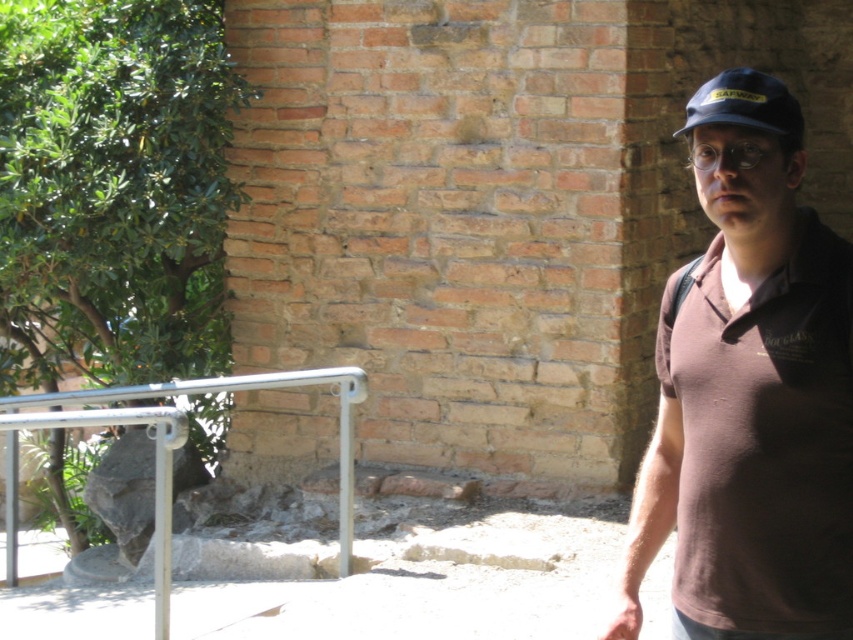
Is silver metallic rail at lower left in front of blue fabric baseball cap at upper right?

No, silver metallic rail at lower left is further to the viewer.

Locate an element on the screen. This screenshot has height=640, width=853. silver metallic rail at lower left is located at coordinates tap(173, 449).

Does brown cotton shirt at right have a larger size compared to silver metallic rail at lower left?

No.

Who is more forward, (844, 385) or (158, 392)?

Point (844, 385) is more forward.

Describe the element at coordinates (750, 394) in the screenshot. This screenshot has height=640, width=853. I see `brown cotton shirt at right` at that location.

Locate an element on the screen. brown cotton shirt at right is located at coordinates (750, 394).

Who is more forward, (732, 161) or (780, 97)?

Point (732, 161) is in front.

Is brown cotton shirt at right behind blue fabric baseball cap at upper right?

No, it is in front of blue fabric baseball cap at upper right.

Measure the distance between brown cotton shirt at right and camera.

3.14 meters

You are a GUI agent. You are given a task and a screenshot of the screen. Output one action in this format:
    pyautogui.click(x=<x>, y=<y>)
    Task: Click on the brown cotton shirt at right
    The height and width of the screenshot is (640, 853).
    Given the screenshot: What is the action you would take?
    pyautogui.click(x=750, y=394)